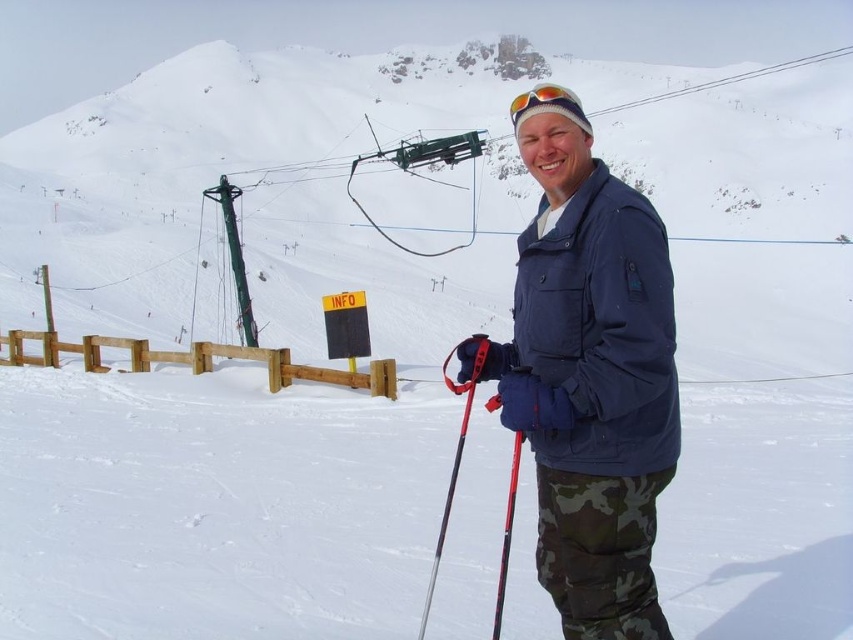
You are a photographer wanting to capture both the blue fabric jacket at center and the camo fabric pants at lower right in a single frame. Given their sizes, which object should you focus on to ensure both are clearly visible?

The blue fabric jacket at center is larger in size than the camo fabric pants at lower right, so focusing on the blue fabric jacket at center would help ensure both are clearly visible in the frame.

In the scene shown: You are navigating a snowy mountain landscape and need to locate the camo fabric pants at lower right. According to the coordinates provided, where exactly would you find them?

The camo fabric pants at lower right are located at point coordinates of (601,552).